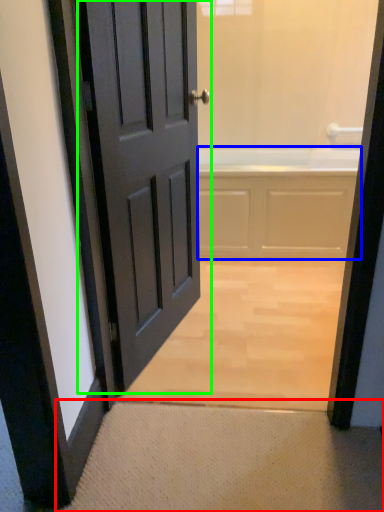
Question: Which object is the farthest from doormat (highlighted by a red box)? Choose among these: bath (highlighted by a blue box) or door (highlighted by a green box).

Choices:
 (A) bath
 (B) door

Answer: (A)